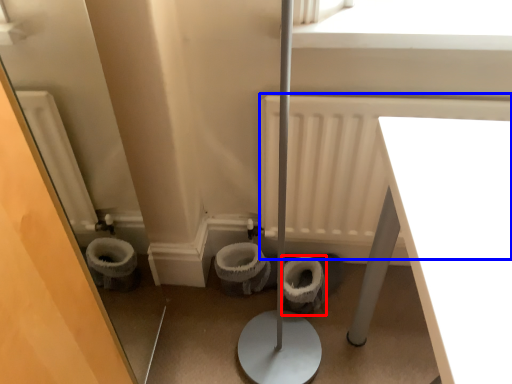
Question: Among these objects, which one is nearest to the camera, toilet bowl (highlighted by a red box) or radiator (highlighted by a blue box)?

Choices:
 (A) toilet bowl
 (B) radiator

Answer: (B)